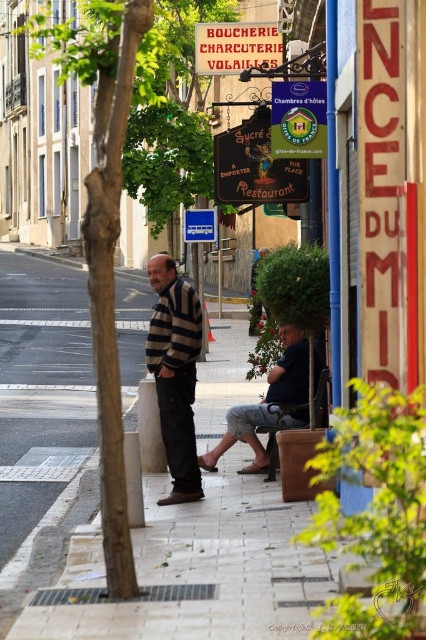
Consider the image. You are walking down the street and see the striped sweater at center and the blue plastic sign at center. Which object is closer to the ground?

The striped sweater at center is located below the blue plastic sign at center, so it is closer to the ground.

You are a photographer trying to capture a candid shot of both the striped sweater at center and the dark blue jeans at lower center from the front. Can you see both subjects clearly without any obstruction?

The dark blue jeans at lower center is behind striped sweater at center, so you cannot see both subjects clearly without obstruction as the striped sweater at center is in front of the dark blue jeans at lower center.